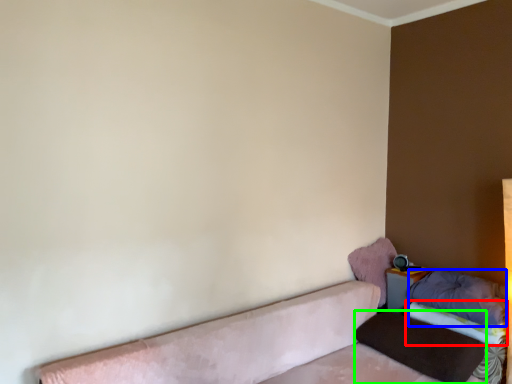
Question: Estimate the real-world distances between objects in this image. Which object is closer to sheet (highlighted by a red box), pillow (highlighted by a blue box) or pillow (highlighted by a green box)?

Choices:
 (A) pillow
 (B) pillow

Answer: (A)